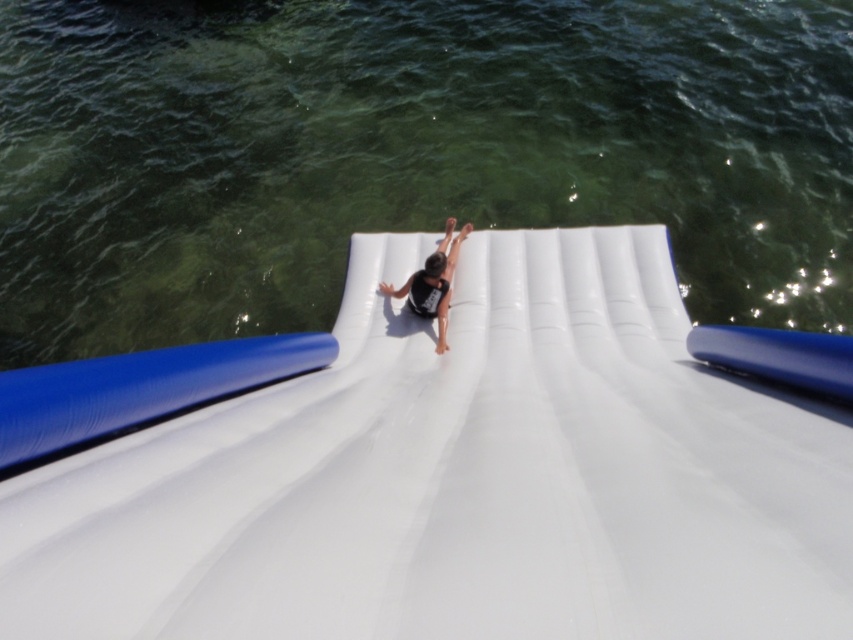
Question: Which point appears closest to the camera in this image?

Choices:
 (A) (607, 394)
 (B) (30, 198)

Answer: (A)

Question: Where is clear water at upper center located in relation to black matte person at center in the image?

Choices:
 (A) above
 (B) below

Answer: (A)

Question: Is white rubber slide at center below black matte person at center?

Choices:
 (A) yes
 (B) no

Answer: (A)

Question: Which point is closer to the camera?

Choices:
 (A) (445, 221)
 (B) (378, 552)

Answer: (B)

Question: Which point appears closest to the camera in this image?

Choices:
 (A) (680, 460)
 (B) (428, 307)

Answer: (A)

Question: Considering the relative positions of clear water at upper center and white rubber slide at center in the image provided, where is clear water at upper center located with respect to white rubber slide at center?

Choices:
 (A) below
 (B) above

Answer: (B)